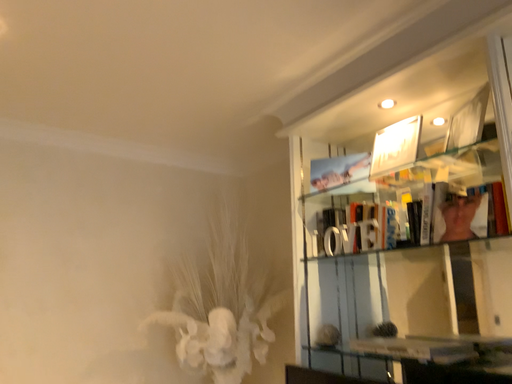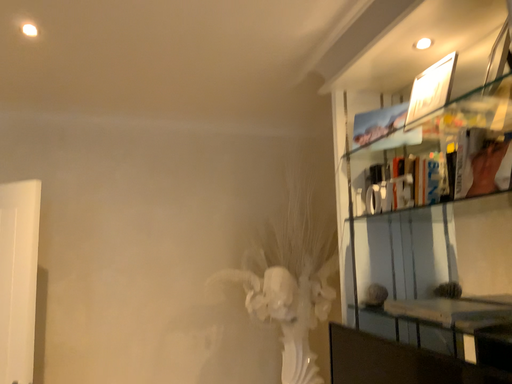
Question: How did the camera likely rotate when shooting the video?

Choices:
 (A) rotated left
 (B) rotated right

Answer: (A)